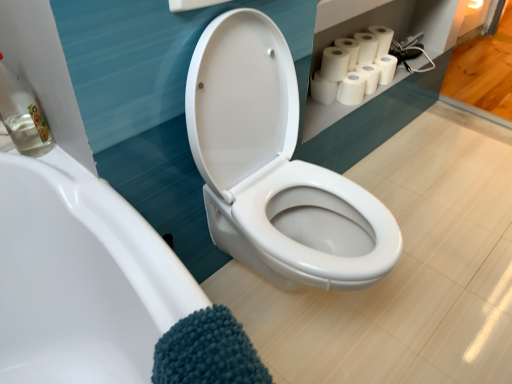
Question: Considering the relative sizes of white matte toilet paper at upper right, the 3th toilet paper when ordered from right to left, and white matte toilet paper at upper right, marked as the second toilet paper in a right-to-left arrangement, in the image provided, is white matte toilet paper at upper right, the 3th toilet paper when ordered from right to left, bigger than white matte toilet paper at upper right, marked as the second toilet paper in a right-to-left arrangement,?

Choices:
 (A) no
 (B) yes

Answer: (A)

Question: Is white matte toilet paper at upper right, the 3th toilet paper when ordered from right to left, positioned behind white matte toilet paper at upper right, marked as the second toilet paper in a right-to-left arrangement?

Choices:
 (A) no
 (B) yes

Answer: (A)

Question: From the image's perspective, is white matte toilet paper at upper right, the 3th toilet paper when ordered from right to left, beneath white matte toilet paper at upper right, marked as the second toilet paper in a right-to-left arrangement?

Choices:
 (A) no
 (B) yes

Answer: (B)

Question: Is white matte toilet paper at upper right, the fifth toilet paper in the left-to-right sequence, positioned far away from white matte toilet paper at upper right, marked as the second toilet paper in a right-to-left arrangement?

Choices:
 (A) yes
 (B) no

Answer: (B)

Question: Considering the relative positions of white matte toilet paper at upper right, the 3th toilet paper when ordered from right to left, and white matte toilet paper at upper right, marked as the 6th toilet paper in a left-to-right arrangement, in the image provided, is white matte toilet paper at upper right, the 3th toilet paper when ordered from right to left, to the left of white matte toilet paper at upper right, marked as the 6th toilet paper in a left-to-right arrangement, from the viewer's perspective?

Choices:
 (A) yes
 (B) no

Answer: (A)

Question: From the image's perspective, is clear glass bottle at left positioned above or below white matte paper towel at upper right?

Choices:
 (A) above
 (B) below

Answer: (B)

Question: Visually, is clear glass bottle at left positioned to the left or to the right of white matte paper towel at upper right?

Choices:
 (A) right
 (B) left

Answer: (B)

Question: Looking at their shapes, would you say clear glass bottle at left is wider or thinner than white matte paper towel at upper right?

Choices:
 (A) wide
 (B) thin

Answer: (B)

Question: Does point (29, 96) appear closer or farther from the camera than point (357, 77)?

Choices:
 (A) closer
 (B) farther

Answer: (A)

Question: Considering the positions of white matte paper towel at upper right and white matte toilet paper at upper right, the 3th toilet paper when ordered from right to left, in the image, is white matte paper towel at upper right wider or thinner than white matte toilet paper at upper right, the 3th toilet paper when ordered from right to left,?

Choices:
 (A) wide
 (B) thin

Answer: (B)

Question: Does point (364, 77) appear closer or farther from the camera than point (373, 79)?

Choices:
 (A) farther
 (B) closer

Answer: (B)

Question: From the image's perspective, is white matte paper towel at upper right located above or below white matte toilet paper at upper right, the fifth toilet paper in the left-to-right sequence?

Choices:
 (A) above
 (B) below

Answer: (B)

Question: Considering the relative positions of white matte paper towel at upper right and white matte toilet paper at upper right, the fifth toilet paper in the left-to-right sequence, in the image provided, is white matte paper towel at upper right to the left or to the right of white matte toilet paper at upper right, the fifth toilet paper in the left-to-right sequence,?

Choices:
 (A) right
 (B) left

Answer: (B)

Question: Considering the positions of white matte toilet paper at upper right, marked as the 6th toilet paper in a left-to-right arrangement, and clear glass bottle at left in the image, is white matte toilet paper at upper right, marked as the 6th toilet paper in a left-to-right arrangement, wider or thinner than clear glass bottle at left?

Choices:
 (A) wide
 (B) thin

Answer: (A)

Question: Would you say white matte toilet paper at upper right, marked as the second toilet paper in a right-to-left arrangement, is to the left or to the right of clear glass bottle at left in the picture?

Choices:
 (A) right
 (B) left

Answer: (A)